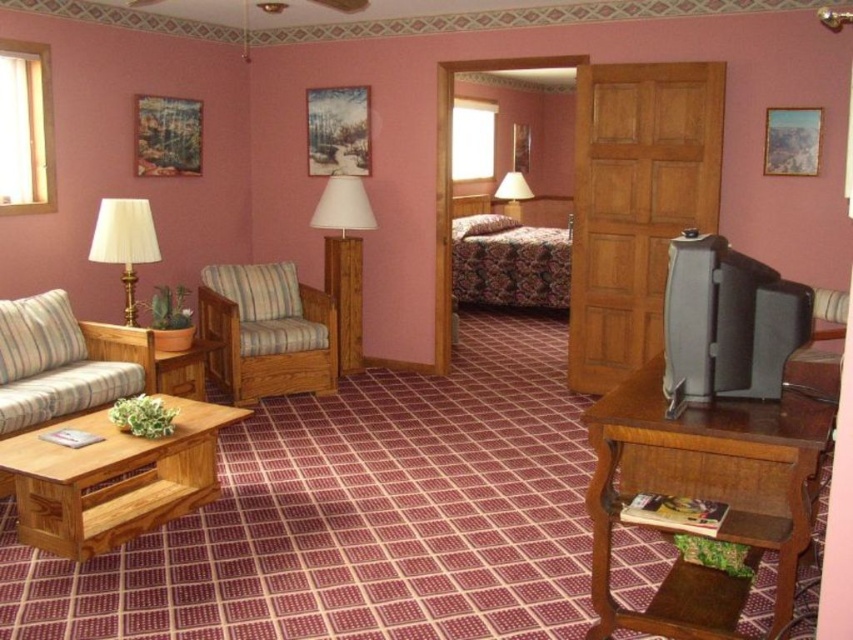
Question: In this image, where is brown wood tv stand at lower right located relative to light brown wooden coffee table at lower left?

Choices:
 (A) right
 (B) left

Answer: (A)

Question: Considering the relative positions of striped fabric armchair at center and white pleated fabric lampshade at left in the image provided, where is striped fabric armchair at center located with respect to white pleated fabric lampshade at left?

Choices:
 (A) left
 (B) right

Answer: (B)

Question: Which point appears farthest from the camera in this image?

Choices:
 (A) (27, 420)
 (B) (509, 212)

Answer: (B)

Question: Which of these objects is positioned closest to the wooden floor lamp at center?

Choices:
 (A) wooden coffee table at lower left
 (B) striped fabric armchair at center
 (C) light brown wooden coffee table at lower left

Answer: (B)

Question: Which object is positioned farthest from the brown wood tv stand at lower right?

Choices:
 (A) striped fabric couch at lower left
 (B) striped fabric armchair at center
 (C) light brown wooden coffee table at lower left

Answer: (B)

Question: Can you confirm if wooden floor lamp at center is wider than matte white lampshade at center?

Choices:
 (A) yes
 (B) no

Answer: (A)